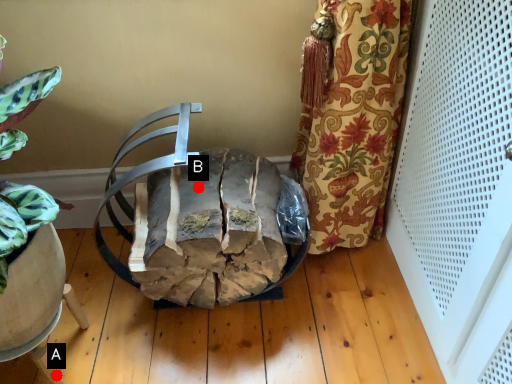
Question: Two points are circled on the image, labeled by A and B beside each circle. Which point is closer to the camera?

Choices:
 (A) A is closer
 (B) B is closer

Answer: (A)